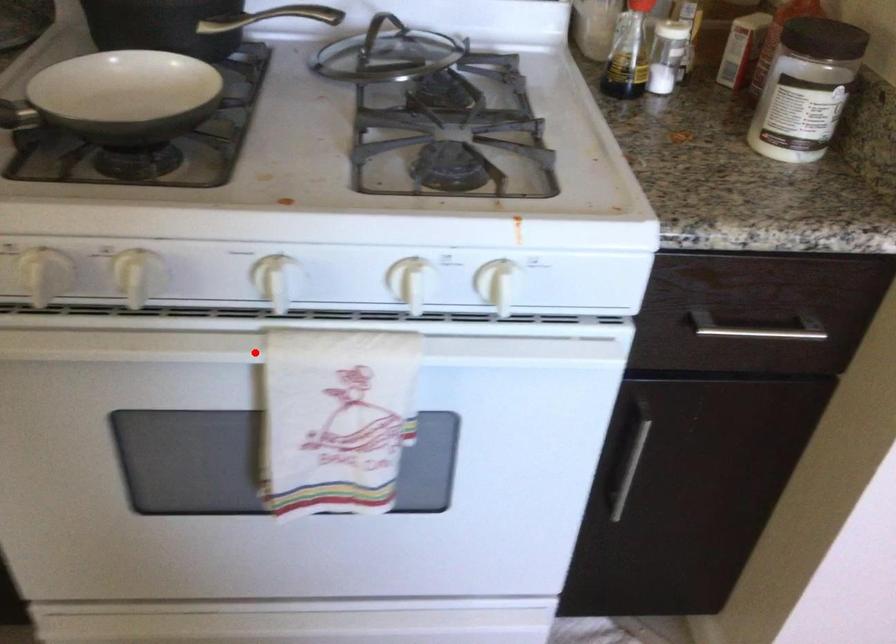
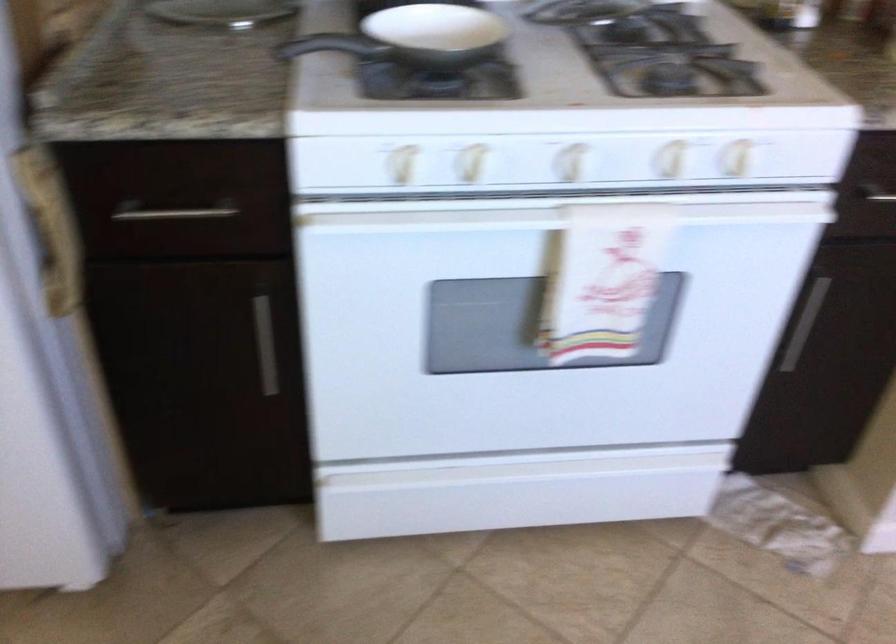
Question: I am providing you with two images of the same scene from different viewpoints. Image1 has a red point marked. In image2, the corresponding 3D location appears at what relative position? Reply with the corresponding letter.

Choices:
 (A) Closer
 (B) Farther

Answer: (B)